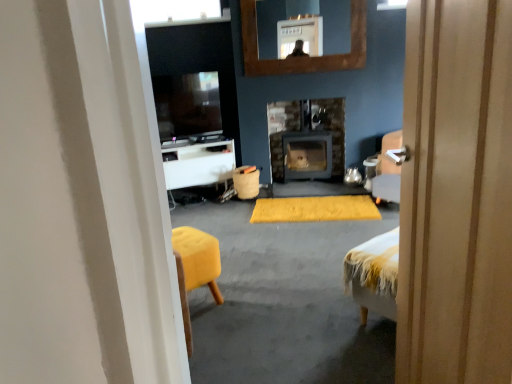
Question: From a real-world perspective, is burlap-like fabric trash can at center physically below yellow fuzzy yoga mat at center?

Choices:
 (A) no
 (B) yes

Answer: (A)

Question: Does burlap-like fabric trash can at center have a lesser width compared to yellow fuzzy yoga mat at center?

Choices:
 (A) no
 (B) yes

Answer: (B)

Question: Can you confirm if burlap-like fabric trash can at center is positioned to the right of yellow fuzzy yoga mat at center?

Choices:
 (A) yes
 (B) no

Answer: (B)

Question: Is burlap-like fabric trash can at center aimed at yellow fuzzy yoga mat at center?

Choices:
 (A) no
 (B) yes

Answer: (A)

Question: Is burlap-like fabric trash can at center behind yellow fuzzy yoga mat at center?

Choices:
 (A) yes
 (B) no

Answer: (A)

Question: Can you confirm if burlap-like fabric trash can at center is smaller than yellow fuzzy yoga mat at center?

Choices:
 (A) no
 (B) yes

Answer: (B)

Question: Is wooden door at center not inside yellow fuzzy yoga mat at center?

Choices:
 (A) yes
 (B) no

Answer: (A)

Question: Considering the relative positions of wooden door at center and yellow fuzzy yoga mat at center in the image provided, is wooden door at center in front of yellow fuzzy yoga mat at center?

Choices:
 (A) no
 (B) yes

Answer: (B)

Question: Is wooden door at center at the right side of yellow fuzzy yoga mat at center?

Choices:
 (A) yes
 (B) no

Answer: (B)

Question: From the image's perspective, is wooden door at center under yellow fuzzy yoga mat at center?

Choices:
 (A) no
 (B) yes

Answer: (B)

Question: Does wooden door at center contain yellow fuzzy yoga mat at center?

Choices:
 (A) yes
 (B) no

Answer: (B)

Question: From a real-world perspective, is wooden door at center on yellow fuzzy yoga mat at center?

Choices:
 (A) yes
 (B) no

Answer: (A)

Question: From a real-world perspective, is matte black wood burning stove at center below transparent glass window at upper center?

Choices:
 (A) yes
 (B) no

Answer: (A)